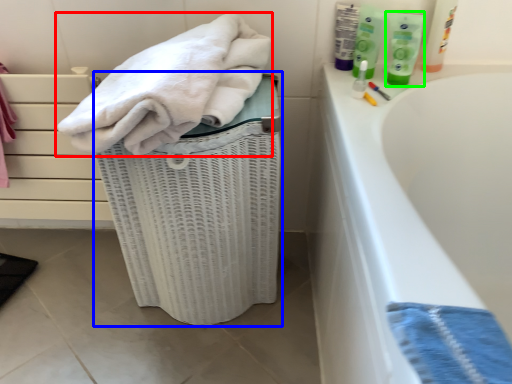
Question: Which is farther away from towel (highlighted by a red box)? laundry basket (highlighted by a blue box) or toiletry (highlighted by a green box)?

Choices:
 (A) laundry basket
 (B) toiletry

Answer: (B)